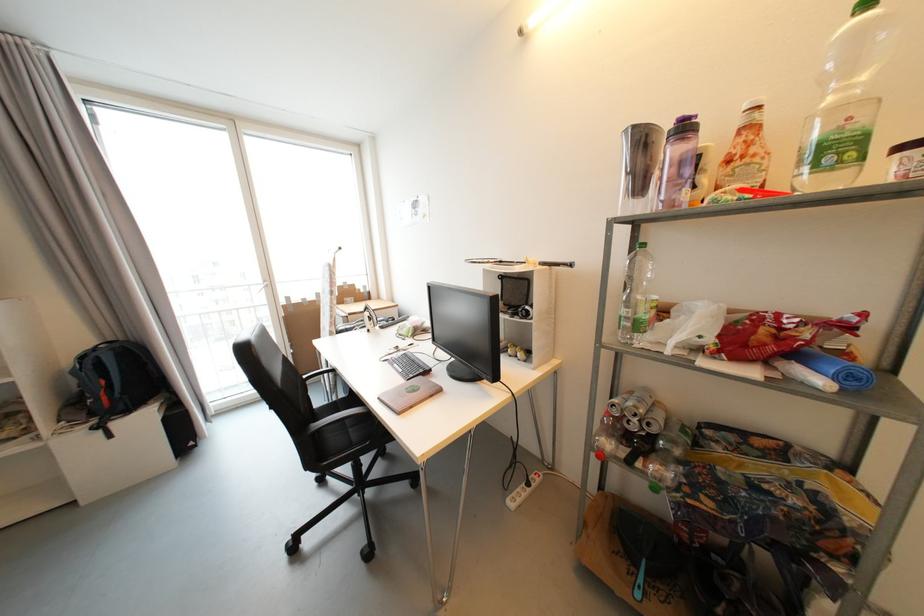
This screenshot has height=616, width=924. What are the coordinates of `tennis racket handle` in the screenshot? It's located at (533, 264).